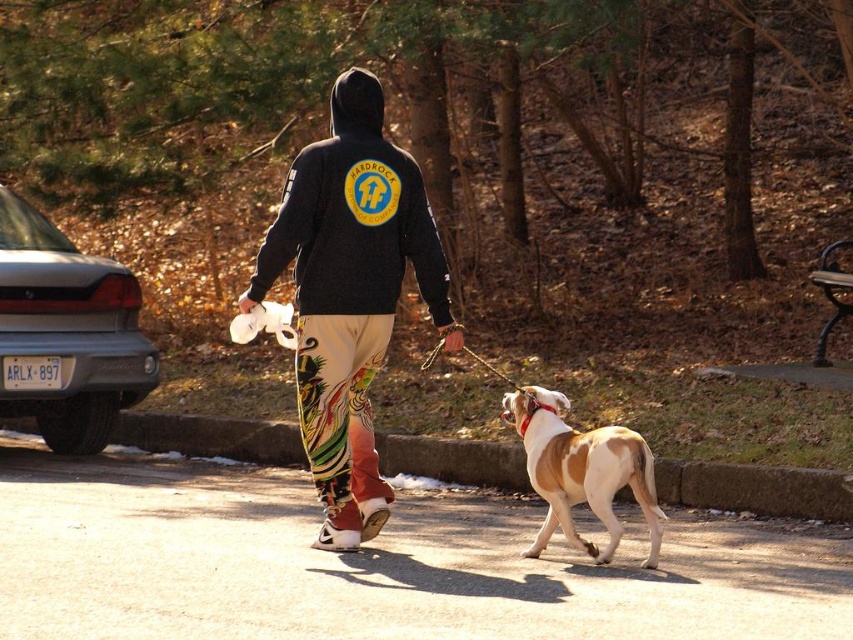
Question: Can you confirm if black matte hoodie at center is positioned to the right of brown and white fur at center?

Choices:
 (A) no
 (B) yes

Answer: (A)

Question: Which object is closer to the camera taking this photo?

Choices:
 (A) black matte hoodie at center
 (B) brown and white fur at center

Answer: (B)

Question: Does black matte hoodie at center have a lesser width compared to brown and white fur at center?

Choices:
 (A) yes
 (B) no

Answer: (B)

Question: Can you confirm if black matte hoodie at center is positioned below brown and white fur at center?

Choices:
 (A) no
 (B) yes

Answer: (A)

Question: Which point appears closest to the camera in this image?

Choices:
 (A) (344, 547)
 (B) (578, 484)

Answer: (B)

Question: Which point is farther to the camera?

Choices:
 (A) black matte hoodie at center
 (B) brown and white fur at center

Answer: (A)